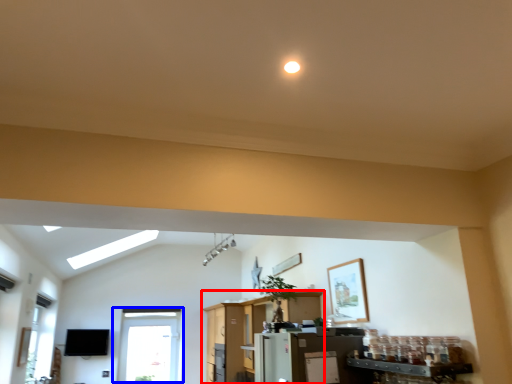
Question: Which object appears closest to the camera in this image, entertainment center (highlighted by a red box) or window (highlighted by a blue box)?

Choices:
 (A) entertainment center
 (B) window

Answer: (A)